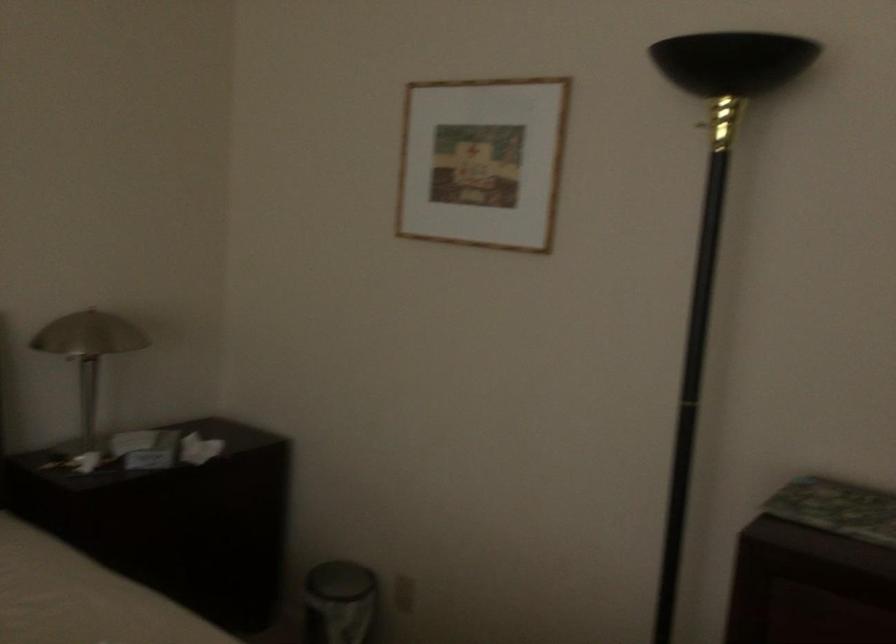
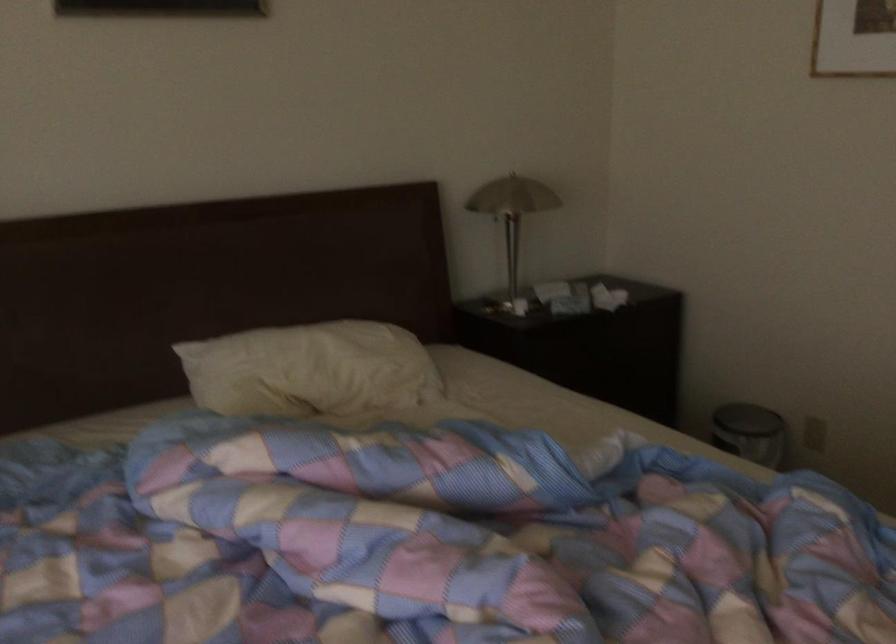
In the second image, find the point that corresponds to point 90,359 in the first image.

(512, 213)